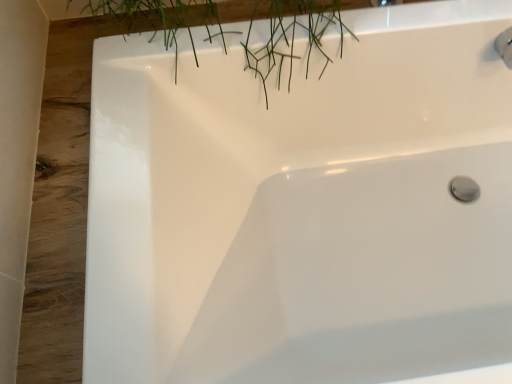
What do you see at coordinates (288, 32) in the screenshot? I see `green grass at upper center` at bounding box center [288, 32].

The image size is (512, 384). I want to click on green grass at upper center, so pos(288,32).

This screenshot has height=384, width=512. Find the location of `green grass at upper center`. green grass at upper center is located at coordinates (288, 32).